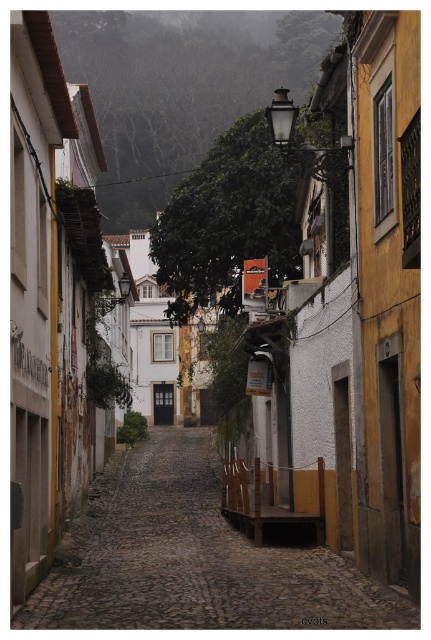
You are a tourist walking down the narrow cobblestone street and want to take a photo of the smooth stone path at center and the yellow textured wall at right. Which object should you focus on if you want to capture the larger feature in your shot?

The smooth stone path at center is bigger than the yellow textured wall at right, so you should focus on the smooth stone path at center to capture the larger feature.

You are a tourist walking along the cobblestone street and want to take a photo of the green leafy hillside at upper center without including the smooth stone path at center in the frame. Which direction should you move to achieve this?

You should move to the left side of the smooth stone path at center so that the green leafy hillside at upper center is positioned to the right of the path, allowing you to frame the hillside without the path in the shot.